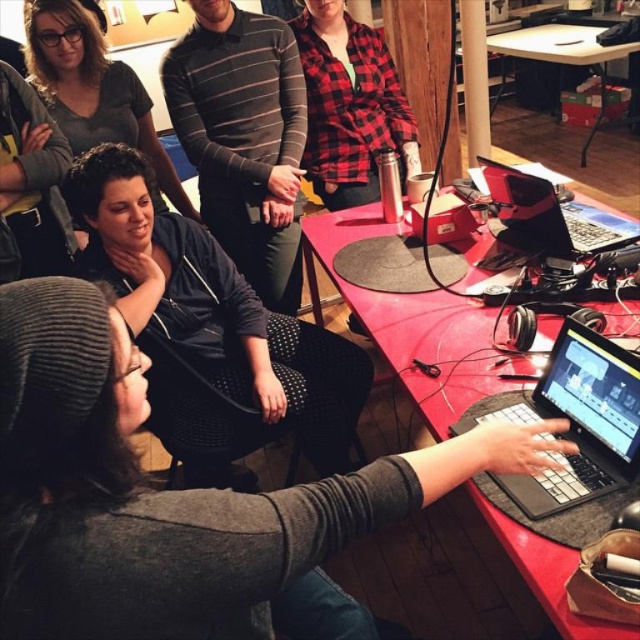
You are organizing a small event and need to place a 2.5 feet wide decorative item on the surface between the matte black jacket at upper left and the wooden table at upper right. Based on their widths, will the item fit?

The matte black jacket at upper left has a lesser width compared to the wooden table at upper right. Since the decorative item is 2.5 feet wide, it can fit between them as the combined width of both objects allows enough space.

Based on the photo, you are organizing a photo shoot and need to ensure that two models wearing the black matte jacket at center and the striped cotton shirt at center can stand side by side in a frame without overlapping. Based on the scene description, which clothing item might require more space horizontally?

The black matte jacket at center might require more space horizontally since it is wider than the striped cotton shirt at center according to the description.